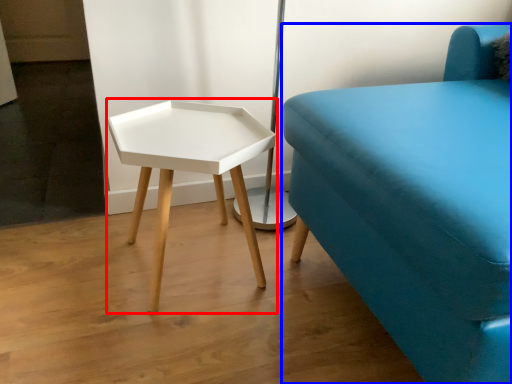
Question: Which object appears closest to the camera in this image, table (highlighted by a red box) or studio couch (highlighted by a blue box)?

Choices:
 (A) table
 (B) studio couch

Answer: (B)